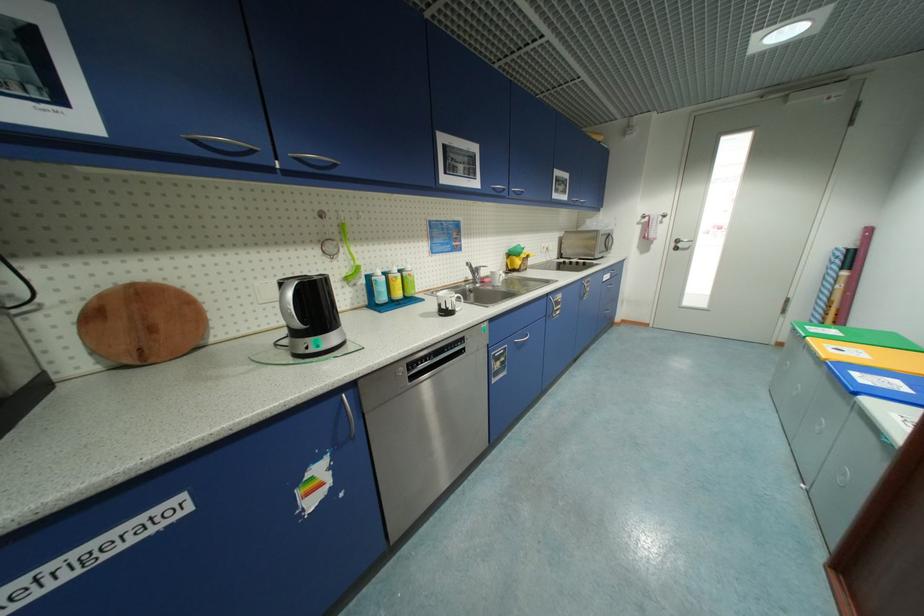
Where would you lift the round cutting board? Please return your answer as a coordinate pair (x, y).

(141, 323)